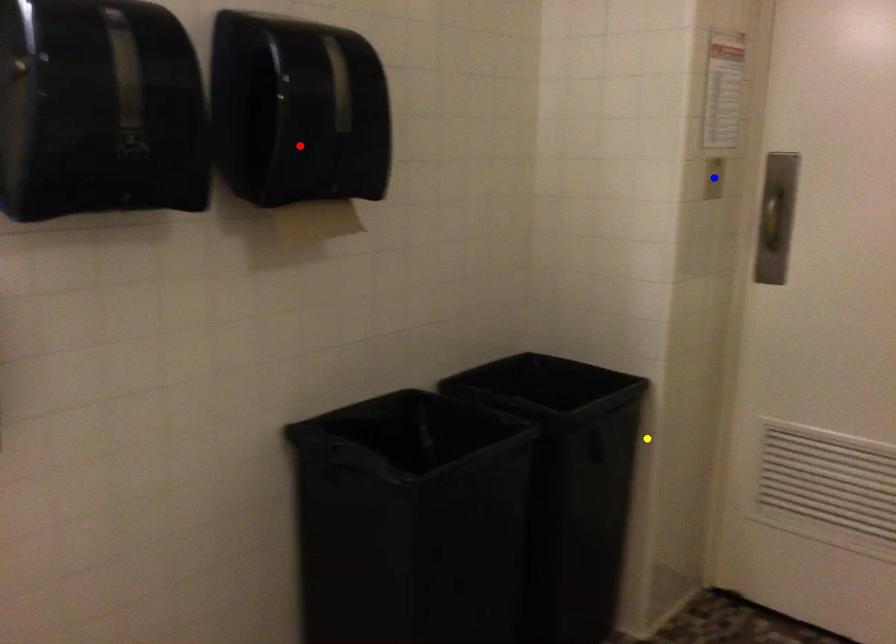
Order these from nearest to farthest:
- yellow point
- red point
- blue point

1. red point
2. blue point
3. yellow point